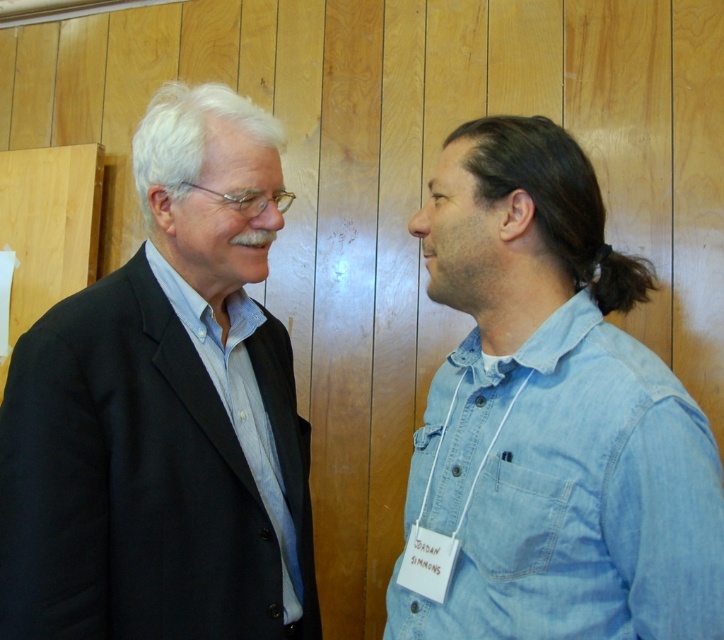
Between black matte suit at left and denim shirt at right, which one appears on the left side from the viewer's perspective?

black matte suit at left is more to the left.

Is black matte suit at left shorter than denim shirt at right?

In fact, black matte suit at left may be taller than denim shirt at right.

Which is in front, point (295, 596) or point (571, 330)?

Positioned in front is point (571, 330).

Locate an element on the screen. black matte suit at left is located at coordinates (164, 412).